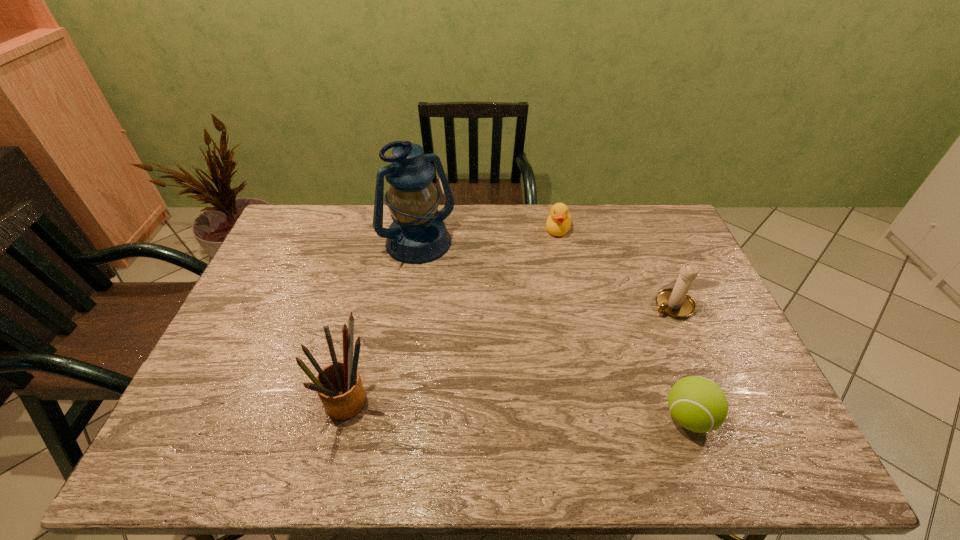
Identify the location of free spot between the duckling and the lantern. Image resolution: width=960 pixels, height=540 pixels. (488, 238).

Identify the location of unoccupied position between the pencil box and the candle holder. This screenshot has width=960, height=540. (510, 356).

Where is `free space between the duckling and the pencil box`? free space between the duckling and the pencil box is located at coordinates (453, 318).

You are a GUI agent. You are given a task and a screenshot of the screen. Output one action in this format:
    pyautogui.click(x=<x>, y=<y>)
    Task: Click on the free space between the pencil box and the third shortest object
    
    Given the screenshot: What is the action you would take?
    pyautogui.click(x=510, y=356)

The width and height of the screenshot is (960, 540). Identify the location of free spot between the tallest object and the fourth shortest object. (383, 326).

Locate an element on the screen. The height and width of the screenshot is (540, 960). free space between the fourth shortest object and the duckling is located at coordinates (453, 318).

In order to click on free space that is in between the duckling and the lantern in this screenshot , I will do `click(488, 238)`.

I want to click on blank region between the second tallest object and the candle holder, so click(510, 356).

Locate an element on the screen. This screenshot has width=960, height=540. free space that is in between the tennis ball and the tallest object is located at coordinates [553, 332].

What are the coordinates of `vacant space that's between the duckling and the third shortest object` in the screenshot? It's located at (615, 267).